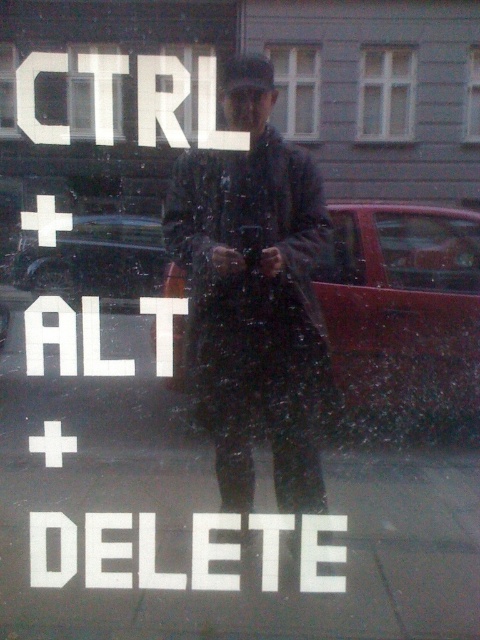
Question: Is dark matte coat at center below transparent glass window at upper center?

Choices:
 (A) yes
 (B) no

Answer: (A)

Question: Which of these objects is positioned closest to the dark matte coat at center?

Choices:
 (A) clear glass window at upper center
 (B) white plastic window at upper center

Answer: (A)

Question: Does dark matte coat at center have a lesser width compared to clear glass window at upper center?

Choices:
 (A) no
 (B) yes

Answer: (A)

Question: Which point is closer to the camera?

Choices:
 (A) transparent glass window at upper center
 (B) dark matte coat at center
 (C) white plastic window at upper center

Answer: (B)

Question: Does dark matte coat at center have a larger size compared to clear glass window at upper center?

Choices:
 (A) no
 (B) yes

Answer: (B)

Question: Among these points, which one is farthest from the camera?

Choices:
 (A) (395, 61)
 (B) (232, 348)
 (C) (474, 116)

Answer: (B)